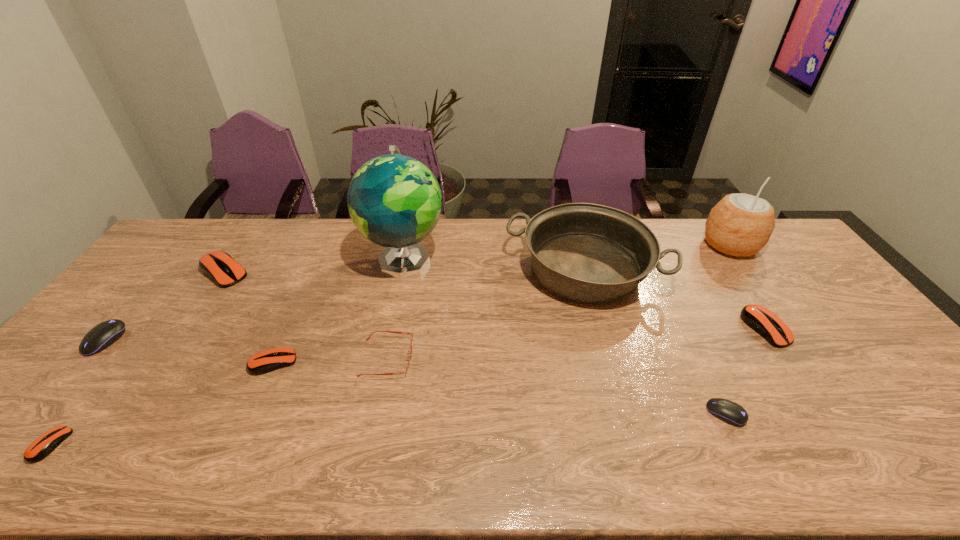
Where is `empty location between the pan and the second computer mouse from right to left`? The width and height of the screenshot is (960, 540). empty location between the pan and the second computer mouse from right to left is located at coordinates (655, 342).

In order to click on free space that is in between the eighth shortest object and the fifth computer mouse from left to right in this screenshot , I will do `click(655, 342)`.

I want to click on free space between the pan and the shortest object, so click(x=318, y=357).

Where is `vacant point located between the coconut and the farther black computer mouse`? vacant point located between the coconut and the farther black computer mouse is located at coordinates [418, 293].

The height and width of the screenshot is (540, 960). Identify the location of empty location between the rightmost orange computer mouse and the spectacles. (577, 343).

Identify the location of empty location between the fifth computer mouse from left to right and the leftmost object. (416, 377).

The width and height of the screenshot is (960, 540). In order to click on free area in between the pan and the rightmost orange computer mouse in this screenshot , I will do `click(675, 299)`.

The height and width of the screenshot is (540, 960). I want to click on vacant area between the left black computer mouse and the second farthest orange computer mouse, so click(x=436, y=334).

Find the location of a particular element. unoccupied position between the nearer black computer mouse and the rightmost computer mouse is located at coordinates (746, 371).

The height and width of the screenshot is (540, 960). Identify the location of the eighth closest object relative to the coconut. [103, 335].